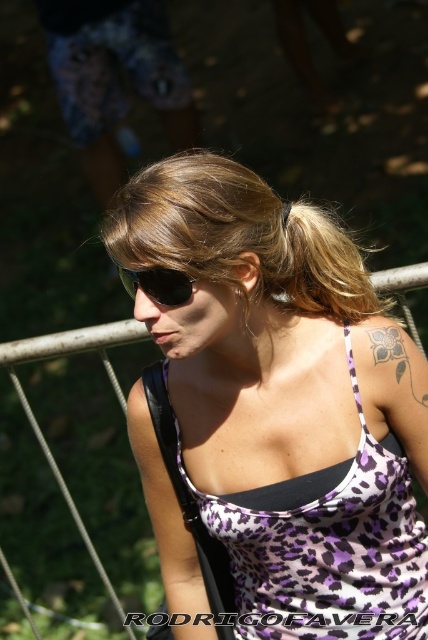
Question: Observing the image, what is the correct spatial positioning of black leather strap at upper center in reference to gray/black ink flower at upper right?

Choices:
 (A) below
 (B) above

Answer: (A)

Question: Which is nearer to the purple leopard print tank top at center?

Choices:
 (A) gray/black ink flower at upper right
 (B) black plastic sunglasses at center

Answer: (A)

Question: Which object appears farthest from the camera in this image?

Choices:
 (A) purple leopard print tank top at center
 (B) gray/black ink flower at upper right
 (C) black plastic sunglasses at center

Answer: (B)

Question: Which of these objects is positioned farthest from the black leather strap at upper center?

Choices:
 (A) black plastic sunglasses at center
 (B) blonde hair at center
 (C) gray/black ink flower at upper right

Answer: (A)

Question: Does blonde hair at center appear on the left side of gray/black ink flower at upper right?

Choices:
 (A) yes
 (B) no

Answer: (A)

Question: Does purple leopard print tank top at center lie behind black leather strap at upper center?

Choices:
 (A) yes
 (B) no

Answer: (B)